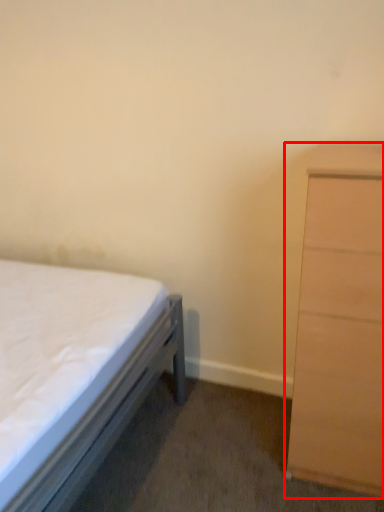
Question: Considering the relative positions of chest of drawers (annotated by the red box) and bed in the image provided, where is chest of drawers (annotated by the red box) located with respect to the staircase?

Choices:
 (A) left
 (B) right

Answer: (B)